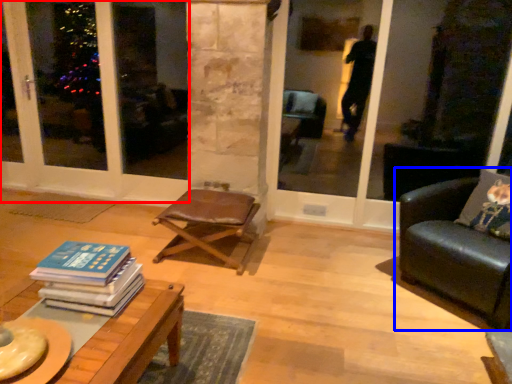
Question: Which object appears farthest to the camera in this image, screen door (highlighted by a red box) or studio couch (highlighted by a blue box)?

Choices:
 (A) screen door
 (B) studio couch

Answer: (A)